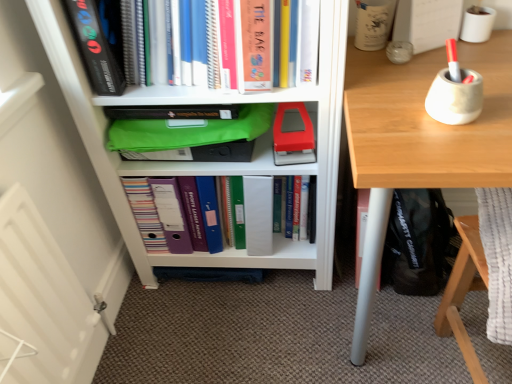
Question: In terms of height, does light wood desk at right look taller or shorter compared to hardcover book at center, placed as the second book when sorted from top to bottom?

Choices:
 (A) short
 (B) tall

Answer: (B)

Question: In terms of size, does light wood desk at right appear bigger or smaller than hardcover book at center, arranged as the 2th book when ordered from the bottom?

Choices:
 (A) big
 (B) small

Answer: (A)

Question: Which object is the farthest from the white matte mug at upper right, which ranks as the 4th stationery in right-to-left order?

Choices:
 (A) white matte pen holder at upper right, positioned as the fourth stationery in left-to-right order
 (B) matte gray pen holder at upper right, which appears as the 2th stationery when viewed from the right
 (C) matte plastic folder at center, which is counted as the third book, starting from the top
 (D) matte red stapler at center, which appears as the 1th paperback book when ordered from the bottom
 (E) clear glass jar at upper right, the second stationery in the left-to-right sequence

Answer: (C)

Question: Estimate the real-world distances between objects in this image. Which object is farther from the white matte mug at upper right, the first stationery from the left?

Choices:
 (A) matte green plastic bag at center
 (B) green fabric bag at center
 (C) hardcover book at upper left, the second paperback book positioned from the right
 (D) clear glass jar at upper right, which ranks as the 3th stationery in right-to-left order
 (E) hardcover book at upper center, which is the third book in bottom-to-top order

Answer: (C)